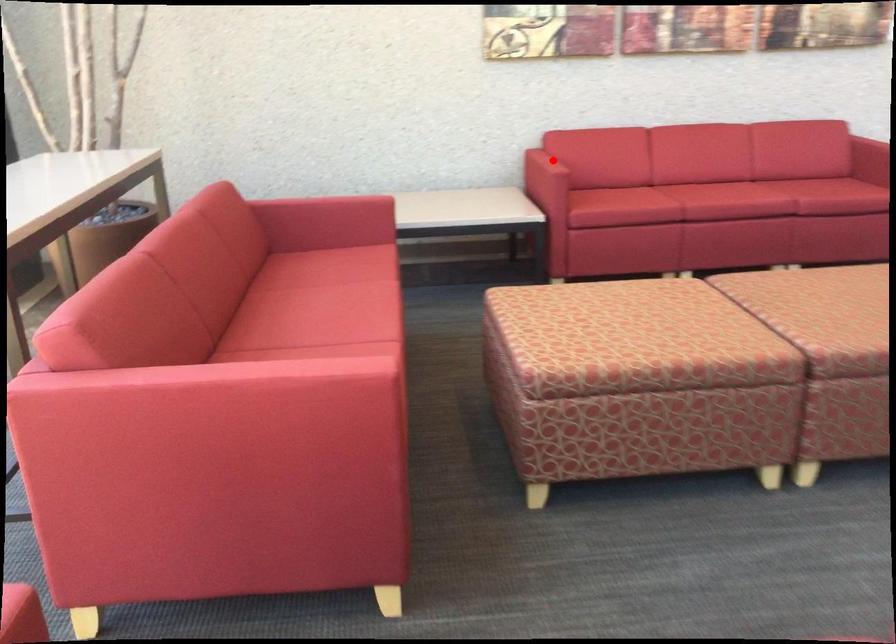
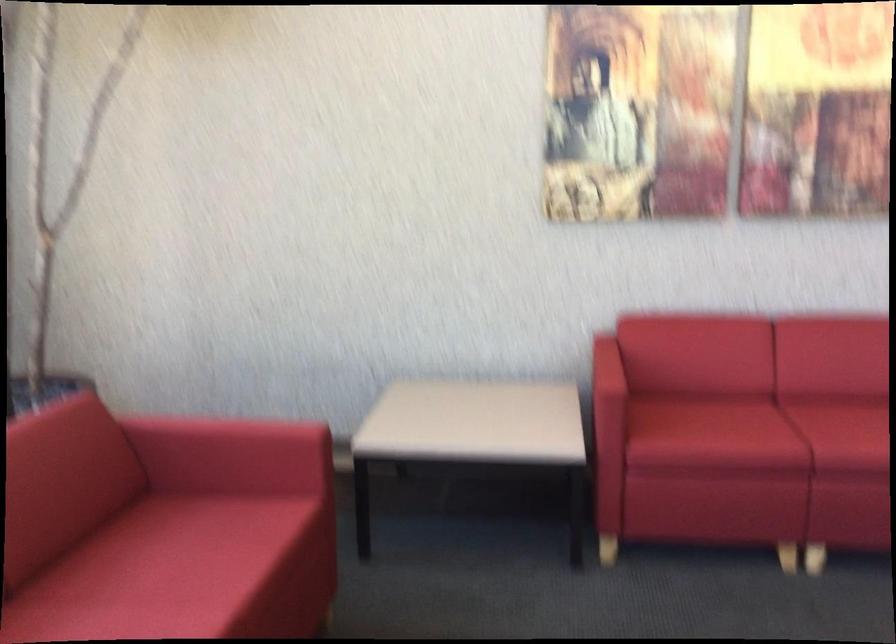
Question: A red point is marked in image1. In image2, is the corresponding 3D point closer to the camera or farther? Reply with the corresponding letter.

Choices:
 (A) The corresponding 3D point is closer.
 (B) The corresponding 3D point is farther.

Answer: (A)